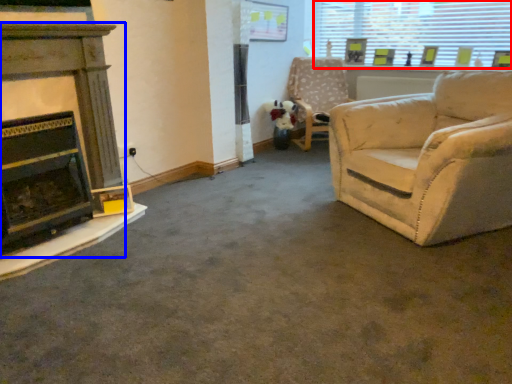
Question: Which object appears closest to the camera in this image, window (highlighted by a red box) or fireplace (highlighted by a blue box)?

Choices:
 (A) window
 (B) fireplace

Answer: (B)